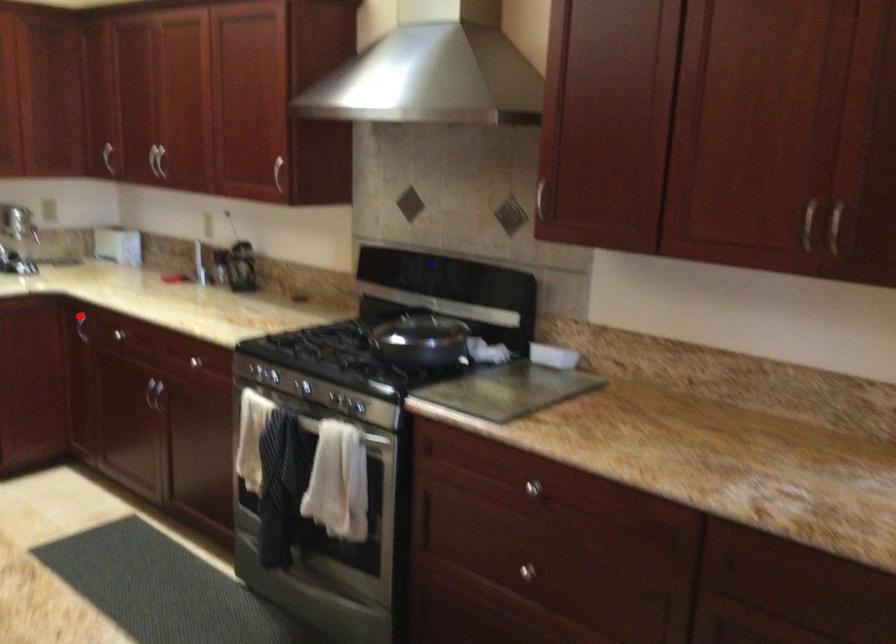
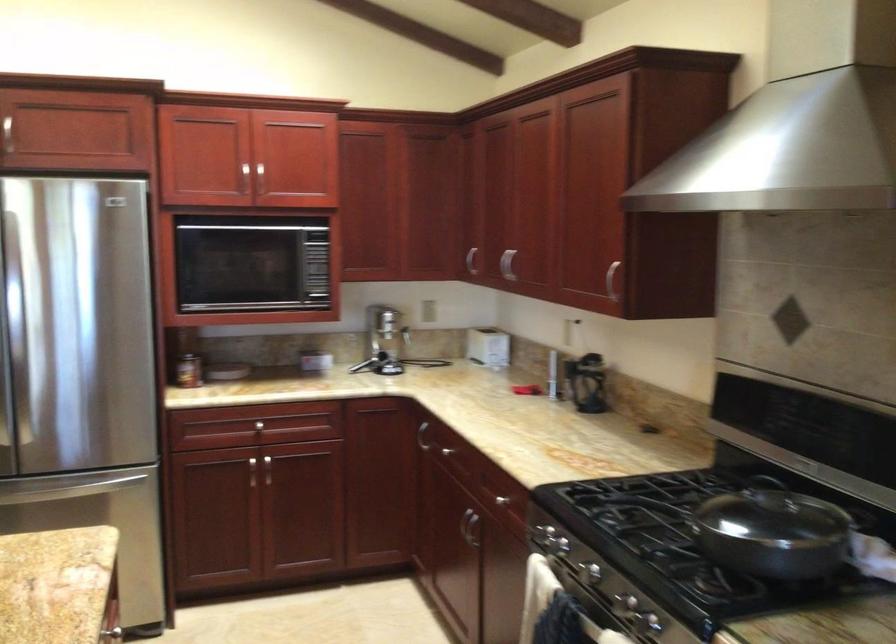
Locate, in the second image, the point that corresponds to the highlighted location in the first image.

(421, 436)